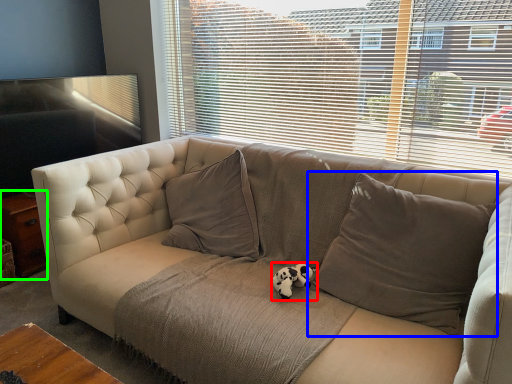
Question: Considering the real-world distances, which object is farthest from animal (highlighted by a red box)? pillow (highlighted by a blue box) or table (highlighted by a green box)?

Choices:
 (A) pillow
 (B) table

Answer: (B)